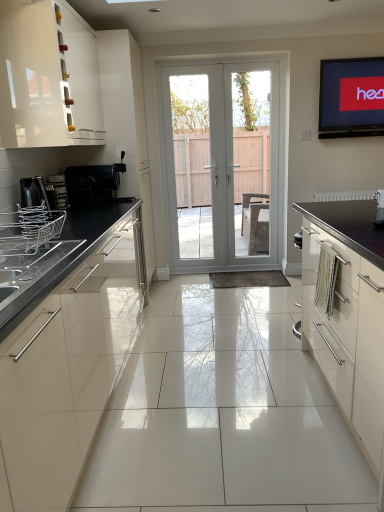
Question: From a real-world perspective, is black matte coffee machine at left, placed as the third appliance when sorted from front to back, under clear glass door at center, which ranks as the 2th screen door in right-to-left order?

Choices:
 (A) yes
 (B) no

Answer: (B)

Question: Does black matte coffee machine at left, arranged as the 1th appliance when viewed from the back, have a lesser width compared to clear glass door at center, positioned as the 1th screen door in left-to-right order?

Choices:
 (A) yes
 (B) no

Answer: (B)

Question: Can you confirm if black matte coffee machine at left, arranged as the 1th appliance when viewed from the back, is positioned to the left of clear glass door at center, which ranks as the 2th screen door in right-to-left order?

Choices:
 (A) yes
 (B) no

Answer: (A)

Question: Is black matte coffee machine at left, the 3th appliance from the bottom, touching clear glass door at center, which ranks as the 2th screen door in right-to-left order?

Choices:
 (A) no
 (B) yes

Answer: (A)

Question: Considering the relative sizes of black matte coffee machine at left, arranged as the 1th appliance when viewed from the back, and clear glass door at center, which ranks as the 2th screen door in right-to-left order, in the image provided, is black matte coffee machine at left, arranged as the 1th appliance when viewed from the back, shorter than clear glass door at center, which ranks as the 2th screen door in right-to-left order,?

Choices:
 (A) no
 (B) yes

Answer: (B)

Question: Considering their positions, is white glossy door at center located in front of or behind satin silver toaster at left, the second appliance positioned from the back?

Choices:
 (A) front
 (B) behind

Answer: (B)

Question: Is white glossy door at center situated inside satin silver toaster at left, the second appliance from the front, or outside?

Choices:
 (A) outside
 (B) inside

Answer: (A)

Question: From their relative heights in the image, would you say white glossy door at center is taller or shorter than satin silver toaster at left, the second appliance from the front?

Choices:
 (A) tall
 (B) short

Answer: (A)

Question: Based on their sizes in the image, would you say white glossy door at center is bigger or smaller than satin silver toaster at left, the second appliance positioned from the back?

Choices:
 (A) small
 (B) big

Answer: (B)

Question: Based on their positions, is clear glass door at center, positioned as the 1th screen door in left-to-right order, located to the left or right of satin silver dish rack at left, which is counted as the third appliance, starting from the top?

Choices:
 (A) right
 (B) left

Answer: (A)

Question: In terms of width, does clear glass door at center, positioned as the 1th screen door in left-to-right order, look wider or thinner when compared to satin silver dish rack at left, marked as the third appliance in a back-to-front arrangement?

Choices:
 (A) wide
 (B) thin

Answer: (B)

Question: In the image, is clear glass door at center, which ranks as the 2th screen door in right-to-left order, positioned in front of or behind satin silver dish rack at left, which is counted as the third appliance, starting from the top?

Choices:
 (A) front
 (B) behind

Answer: (B)

Question: Is clear glass door at center, positioned as the 1th screen door in left-to-right order, bigger or smaller than satin silver dish rack at left, marked as the third appliance in a back-to-front arrangement?

Choices:
 (A) big
 (B) small

Answer: (A)

Question: Which is correct: white glossy door at center is inside white glossy door at center, which is the 2th screen door in left-to-right order, or outside of it?

Choices:
 (A) inside
 (B) outside

Answer: (A)

Question: From a real-world perspective, is white glossy door at center positioned above or below white glossy door at center, which is the 2th screen door in left-to-right order?

Choices:
 (A) above
 (B) below

Answer: (B)